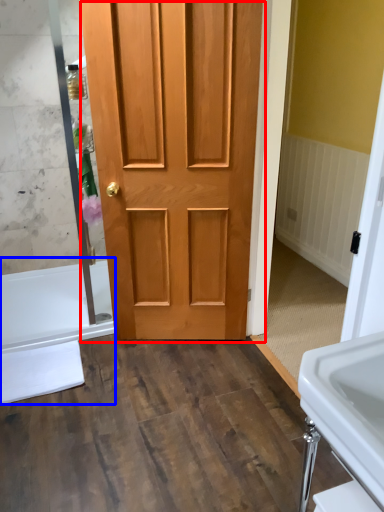
Question: Which point is closer to the camera, door (highlighted by a red box) or bath (highlighted by a blue box)?

Choices:
 (A) door
 (B) bath

Answer: (A)